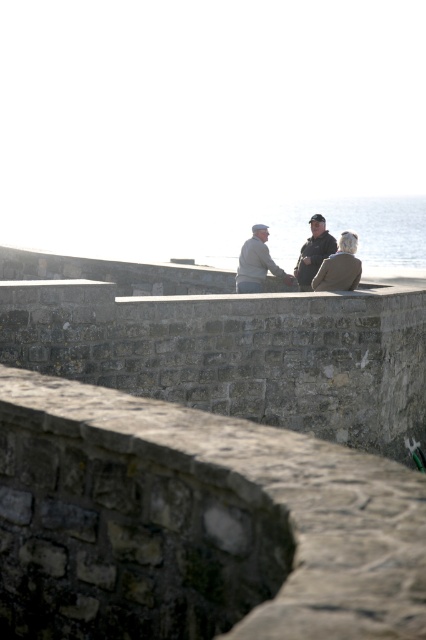
Question: Can you confirm if light gray sweater at center is positioned to the right of dark gray jacket at center?

Choices:
 (A) yes
 (B) no

Answer: (B)

Question: Which object is positioned farthest from the light gray sweater at center?

Choices:
 (A) dark gray jacket at center
 (B) dark gray knit hat at center

Answer: (A)

Question: Can you confirm if dark gray knit hat at center is positioned to the right of dark gray jacket at center?

Choices:
 (A) yes
 (B) no

Answer: (B)

Question: Can you confirm if light gray sweater at center is smaller than dark gray jacket at center?

Choices:
 (A) yes
 (B) no

Answer: (A)

Question: Based on their relative distances, which object is nearer to the dark gray jacket at center?

Choices:
 (A) light gray sweater at center
 (B) dark gray knit hat at center

Answer: (B)

Question: Which object is closer to the camera taking this photo?

Choices:
 (A) dark gray jacket at center
 (B) light gray sweater at center
 (C) dark gray knit hat at center

Answer: (C)